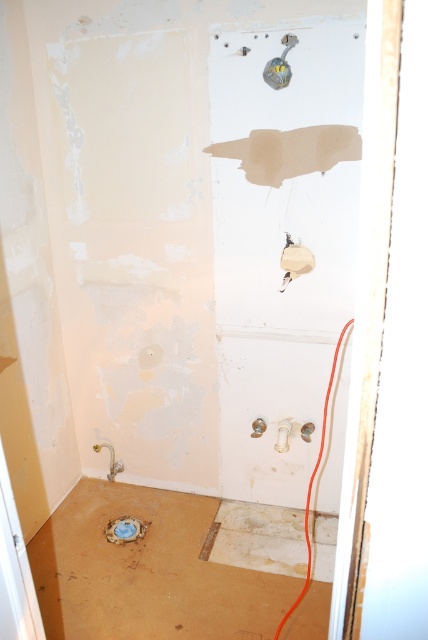
Question: From the image, what is the correct spatial relationship of matte white outlet at center in relation to matte plastic drain at lower center?

Choices:
 (A) right
 (B) left

Answer: (A)

Question: Is matte white outlet at center further to camera compared to matte plastic drain at lower center?

Choices:
 (A) yes
 (B) no

Answer: (B)

Question: Which point is closer to the camera taking this photo?

Choices:
 (A) (282, 264)
 (B) (136, 536)

Answer: (A)

Question: Is matte white outlet at center further to the viewer compared to matte plastic drain at lower center?

Choices:
 (A) yes
 (B) no

Answer: (B)

Question: Which object appears farthest from the camera in this image?

Choices:
 (A) matte plastic drain at lower center
 (B) matte white outlet at center

Answer: (A)